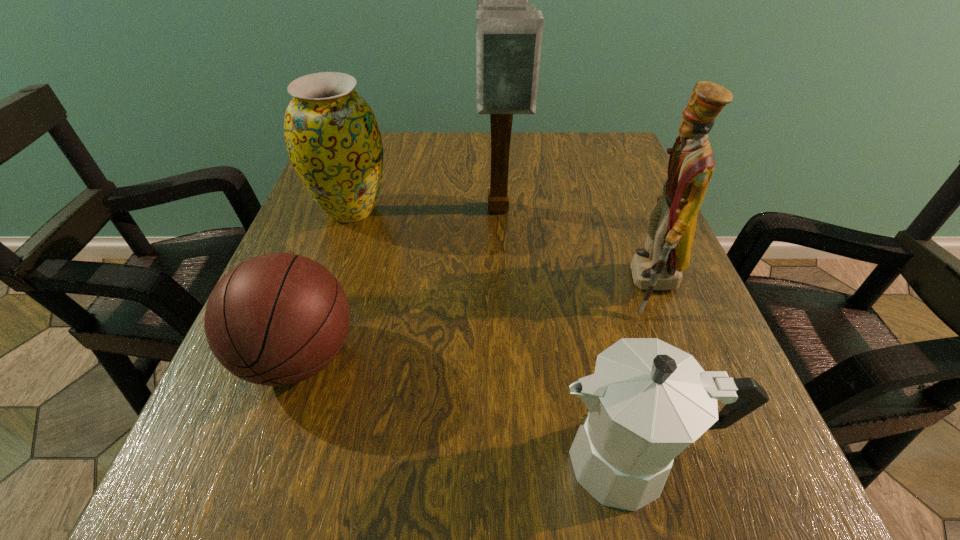
At what (x,y) coordinates should I click in order to perform the action: click on the third object from left to right. Please return your answer as a coordinate pair (x, y). Image resolution: width=960 pixels, height=540 pixels. Looking at the image, I should click on (509, 31).

At what (x,y) coordinates should I click in order to perform the action: click on the fourth shortest object. Please return your answer as a coordinate pair (x, y). Looking at the image, I should click on (658, 266).

Where is `the third shortest object`? the third shortest object is located at coordinates (333, 140).

Find the location of `coffeepot`. coffeepot is located at coordinates (648, 400).

Where is `the nearest object`? the nearest object is located at coordinates (648, 400).

I want to click on basketball, so click(276, 319).

Where is `free location located 0.190m on the left of the third object from right to left`? free location located 0.190m on the left of the third object from right to left is located at coordinates (387, 211).

I want to click on free spot located 0.250m on the front-facing side of the nutcracker, so click(x=482, y=286).

Find the location of a particular element. The height and width of the screenshot is (540, 960). free region located on the front-facing side of the nutcracker is located at coordinates pos(465,286).

Where is `blank area located 0.380m on the front-facing side of the nutcracker`? The width and height of the screenshot is (960, 540). blank area located 0.380m on the front-facing side of the nutcracker is located at coordinates (407, 286).